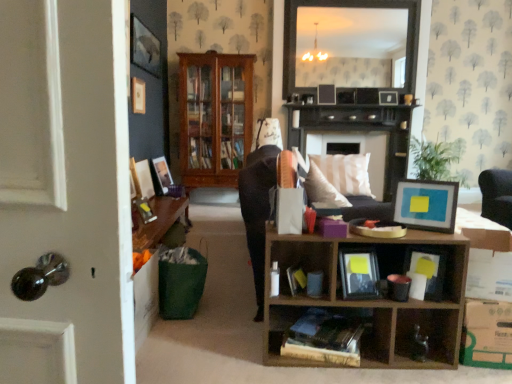
Question: Is wooden cabinet at center at the right side of matte black book at lower right, the first book in the right-to-left sequence?

Choices:
 (A) no
 (B) yes

Answer: (A)

Question: Is wooden cabinet at center bigger than matte black book at lower right, the third book when ordered from left to right?

Choices:
 (A) no
 (B) yes

Answer: (B)

Question: Is wooden cabinet at center positioned far away from matte black book at lower right, the third book when ordered from left to right?

Choices:
 (A) yes
 (B) no

Answer: (A)

Question: Is wooden cabinet at center surrounding matte black book at lower right, the third book when ordered from left to right?

Choices:
 (A) yes
 (B) no

Answer: (B)

Question: From the image's perspective, is wooden cabinet at center on matte black book at lower right, the first book in the right-to-left sequence?

Choices:
 (A) yes
 (B) no

Answer: (A)

Question: Is wooden cabinet at center positioned with its back to matte black book at lower right, the first book in the right-to-left sequence?

Choices:
 (A) no
 (B) yes

Answer: (A)

Question: From a real-world perspective, is dark wood fireplace at center located beneath wooden picture frame at left, placed as the third picture frame when sorted from front to back?

Choices:
 (A) no
 (B) yes

Answer: (A)

Question: Does dark wood fireplace at center lie in front of wooden picture frame at left, positioned as the 2th picture frame in left-to-right order?

Choices:
 (A) no
 (B) yes

Answer: (A)

Question: Is dark wood fireplace at center not near wooden picture frame at left, placed as the third picture frame when sorted from front to back?

Choices:
 (A) no
 (B) yes

Answer: (B)

Question: Is dark wood fireplace at center outside wooden picture frame at left, marked as the 6th picture frame in a right-to-left arrangement?

Choices:
 (A) yes
 (B) no

Answer: (A)

Question: Considering the relative sizes of dark wood fireplace at center and wooden picture frame at left, marked as the 6th picture frame in a right-to-left arrangement, in the image provided, is dark wood fireplace at center smaller than wooden picture frame at left, marked as the 6th picture frame in a right-to-left arrangement,?

Choices:
 (A) no
 (B) yes

Answer: (A)

Question: Does dark wood fireplace at center have a greater width compared to wooden picture frame at left, positioned as the 2th picture frame in left-to-right order?

Choices:
 (A) yes
 (B) no

Answer: (A)

Question: Is matte black mirror at upper center directly adjacent to matte black picture frame at upper center, which ranks as the 1th picture frame in right-to-left order?

Choices:
 (A) yes
 (B) no

Answer: (B)